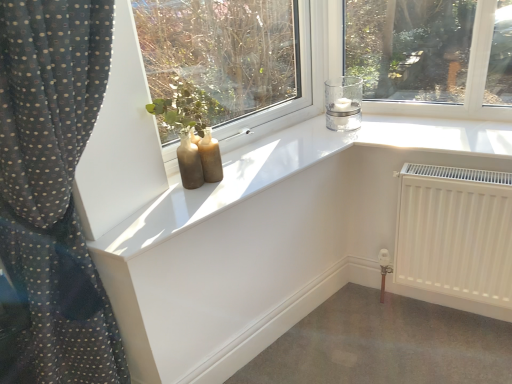
Identify the location of free spot below white matte radiator at lower right (from a real-world perspective). The height and width of the screenshot is (384, 512). (443, 319).